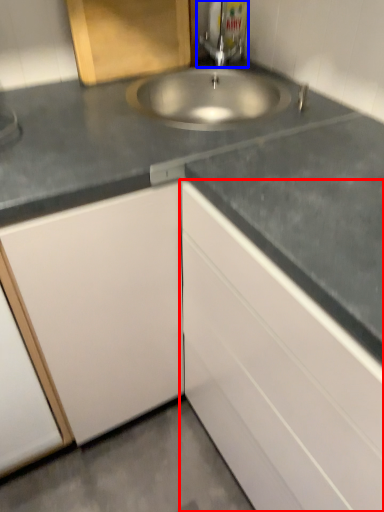
Question: Which point is closer to the camera, cabinetry (highlighted by a red box) or tap (highlighted by a blue box)?

Choices:
 (A) cabinetry
 (B) tap

Answer: (A)